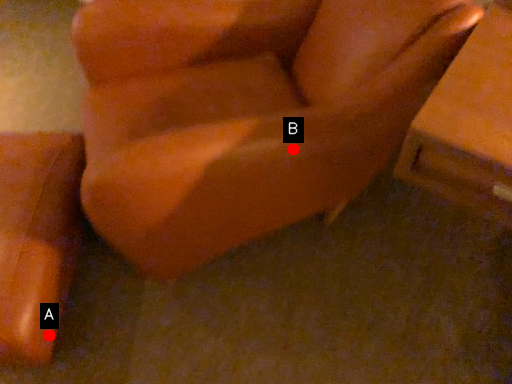
Question: Two points are circled on the image, labeled by A and B beside each circle. Which point is further to the camera?

Choices:
 (A) A is further
 (B) B is further

Answer: (A)